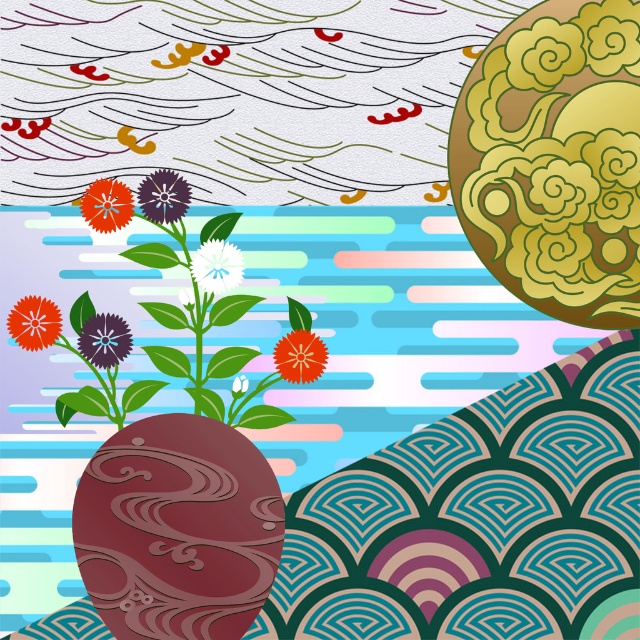
In the scene shown: You are arranging flowers in a room and notice the matte orange flower at lower left and the matte ceramic vase at center. Which object is located higher up in the image?

The matte orange flower at lower left is positioned above the matte ceramic vase at center, so it is located higher up in the image.

You are an artist analyzing the composition of the image. The matte ceramic vase at center is part of your study. Can you confirm its exact 2D coordinates within the image frame?

The matte ceramic vase at center is located at the 2D coordinates point (193,323).